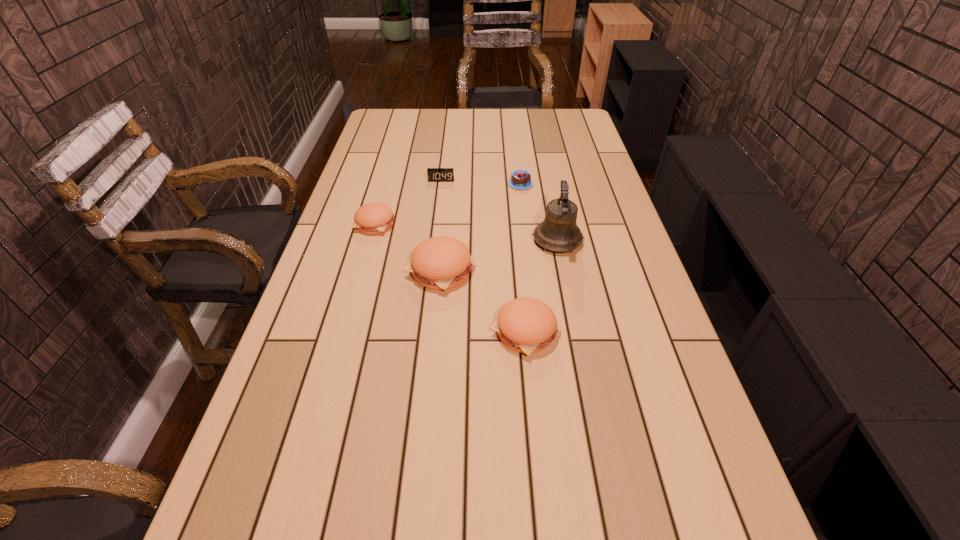
At what (x,y) coordinates should I click in order to perform the action: click on vacant position located 0.290m on the left of the rightmost patty. Please return your answer as a coordinate pair (x, y). Looking at the image, I should click on (371, 332).

Identify the location of free spot located on the front of the tallest object. The height and width of the screenshot is (540, 960). (582, 364).

This screenshot has width=960, height=540. Find the location of `vacant space situated 0.240m on the front-facing side of the alarm clock`. vacant space situated 0.240m on the front-facing side of the alarm clock is located at coordinates (436, 223).

Locate an element on the screen. free space located 0.360m on the left of the chocolate cake is located at coordinates (405, 184).

Where is `object present at the left edge`? object present at the left edge is located at coordinates (373, 218).

Image resolution: width=960 pixels, height=540 pixels. I want to click on object that is at the right edge, so click(559, 232).

The height and width of the screenshot is (540, 960). Find the location of `free location at the far edge`. free location at the far edge is located at coordinates (498, 122).

Identify the location of vacant area at the near edge. The width and height of the screenshot is (960, 540). (474, 484).

At what (x,y) coordinates should I click in order to perform the action: click on free region at the left edge. Please return your answer as a coordinate pair (x, y). This screenshot has width=960, height=540. Looking at the image, I should click on (324, 255).

Locate an element on the screen. This screenshot has width=960, height=540. vacant space at the right edge is located at coordinates (600, 187).